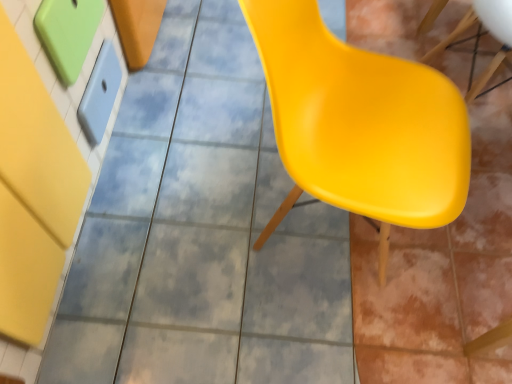
This screenshot has height=384, width=512. I want to click on matte yellow chair at center, so click(x=360, y=124).

The height and width of the screenshot is (384, 512). Describe the element at coordinates (360, 124) in the screenshot. I see `matte yellow chair at center` at that location.

Where is `matte yellow chair at center`? matte yellow chair at center is located at coordinates (360, 124).